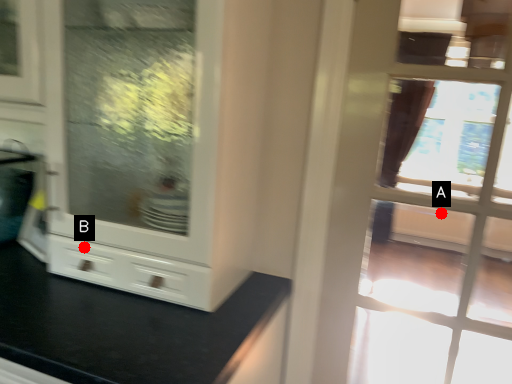
Question: Two points are circled on the image, labeled by A and B beside each circle. Which point is farther to the camera?

Choices:
 (A) A is further
 (B) B is further

Answer: (A)